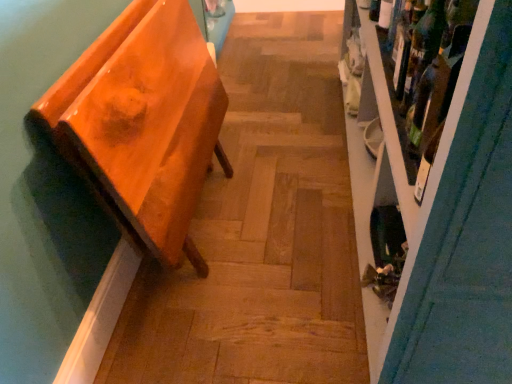
Question: Can you confirm if glossy orange bench at left is smaller than green glass wine bottle at upper right?

Choices:
 (A) yes
 (B) no

Answer: (B)

Question: Does glossy orange bench at left have a greater width compared to green glass wine bottle at upper right?

Choices:
 (A) yes
 (B) no

Answer: (A)

Question: Is glossy orange bench at left far from green glass wine bottle at upper right?

Choices:
 (A) yes
 (B) no

Answer: (B)

Question: Is glossy orange bench at left closer to camera compared to green glass wine bottle at upper right?

Choices:
 (A) no
 (B) yes

Answer: (B)

Question: From the image's perspective, is glossy orange bench at left over green glass wine bottle at upper right?

Choices:
 (A) yes
 (B) no

Answer: (B)

Question: Considering the positions of point (430, 6) and point (379, 3), is point (430, 6) closer or farther from the camera than point (379, 3)?

Choices:
 (A) closer
 (B) farther

Answer: (A)

Question: Choose the correct answer: Is green glass wine bottle at upper right inside translucent glass bottle at upper right or outside it?

Choices:
 (A) inside
 (B) outside

Answer: (B)

Question: Looking at their shapes, would you say green glass wine bottle at upper right is wider or thinner than translucent glass bottle at upper right?

Choices:
 (A) wide
 (B) thin

Answer: (A)

Question: Considering the relative positions of green glass wine bottle at upper right and translucent glass bottle at upper right in the image provided, is green glass wine bottle at upper right to the left or to the right of translucent glass bottle at upper right?

Choices:
 (A) right
 (B) left

Answer: (B)

Question: Is wooden shelf at right spatially inside translucent glass bottle at upper right, or outside of it?

Choices:
 (A) inside
 (B) outside

Answer: (B)

Question: Looking at their shapes, would you say wooden shelf at right is wider or thinner than translucent glass bottle at upper right?

Choices:
 (A) wide
 (B) thin

Answer: (A)

Question: Is wooden shelf at right to the left or to the right of translucent glass bottle at upper right in the image?

Choices:
 (A) right
 (B) left

Answer: (A)

Question: Is point (488, 82) closer or farther from the camera than point (381, 23)?

Choices:
 (A) closer
 (B) farther

Answer: (A)

Question: From the image's perspective, is glossy orange bench at left positioned above or below translucent glass bottle at upper right?

Choices:
 (A) above
 (B) below

Answer: (B)

Question: Relative to translucent glass bottle at upper right, is glossy orange bench at left in front or behind?

Choices:
 (A) behind
 (B) front

Answer: (B)